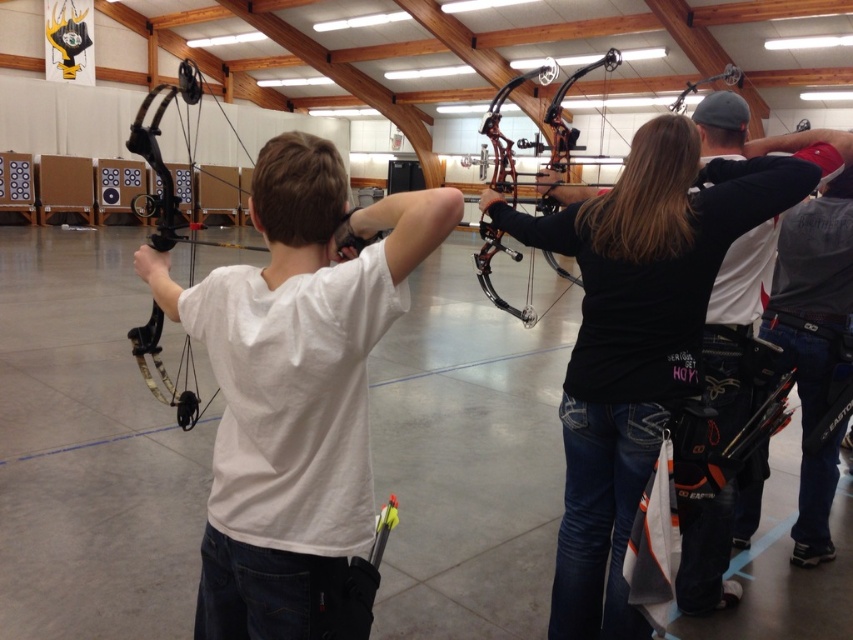
You are an archery instructor standing at the center of the archery range. You need to retrieve both the white matte shirt at center and the black matte bow at center for a demonstration. Given that you can only carry one item at a time, which item should you pick up first to minimize the total distance walked?

You should pick up the white matte shirt at center first because it is closer to you at the center than the black matte bow at center, which is 1.10 meters away from it. This reduces the total distance walked by retrieving the closer item first.

You are an archer aiming to hit the target. You notice a point at coordinates (294, 381) in the image. Which object in the scene is this point located on?

The point at coordinates (294, 381) is located on the white matte shirt at center.

You are an archery instructor observing the black matte bow at center and the matte black bow at left. Which bow has a narrower width?

The black matte bow at center has a lesser width compared to the matte black bow at left, so the black matte bow at center is narrower.